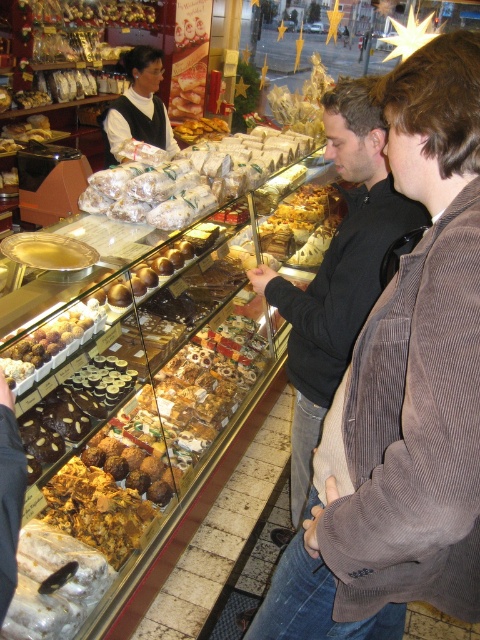
Question: Can you confirm if white paper wrapped pastries at center is bigger than matte black vest at center?

Choices:
 (A) no
 (B) yes

Answer: (B)

Question: Which of the following is the farthest from the observer?

Choices:
 (A) matte black vest at center
 (B) white paper wrapped pastries at center
 (C) black corduroy jacket at center

Answer: (A)

Question: Is the position of white paper wrapped pastries at center less distant than that of matte black vest at center?

Choices:
 (A) no
 (B) yes

Answer: (B)

Question: Which object appears farthest from the camera in this image?

Choices:
 (A) white paper wrapped pastries at center
 (B) matte black vest at center

Answer: (B)

Question: Does black corduroy jacket at center have a lesser width compared to white paper wrapped pastries at center?

Choices:
 (A) no
 (B) yes

Answer: (B)

Question: Which of the following is the closest to the observer?

Choices:
 (A) matte black vest at center
 (B) black corduroy jacket at center

Answer: (B)